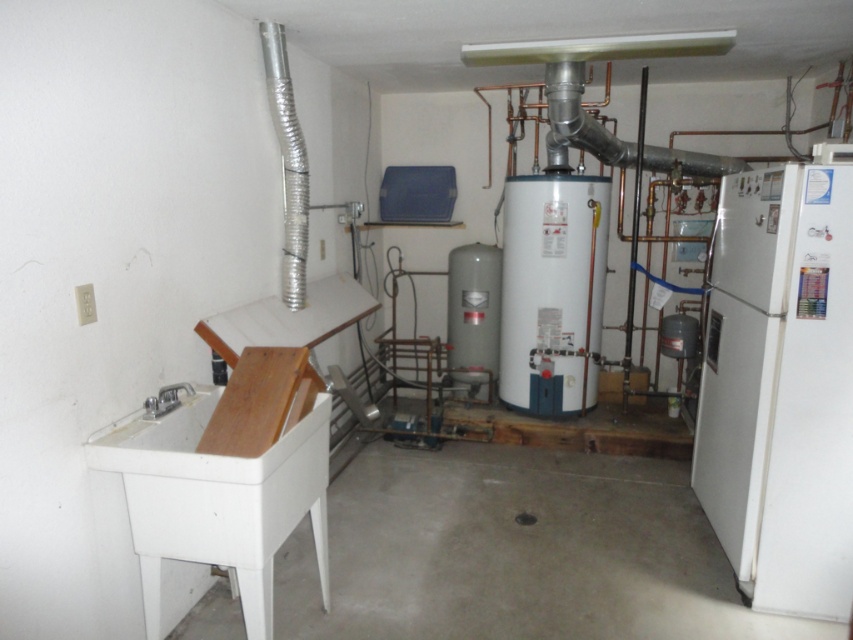
You are standing in the utility room and want to reach the light switch above the sink on the left. The white matte refrigerator at right is blocking your view. Can you estimate if you can move around the refrigerator to access the light switch?

The white matte refrigerator at right is 7.61 feet away from the viewer. Since the refrigerator is positioned at the right side of the room and the light switch is on the left, you should be able to move around the refrigerator to access the light switch as they are on opposite sides of the room.

You are a technician entering the utility room and need to access both the gray matte water heater at center and the silver metallic duct at upper left. Which object will you encounter first as you walk into the room?

The gray matte water heater at center is closer to the viewer than the silver metallic duct at upper left, so you will encounter the gray matte water heater at center first when entering the room.